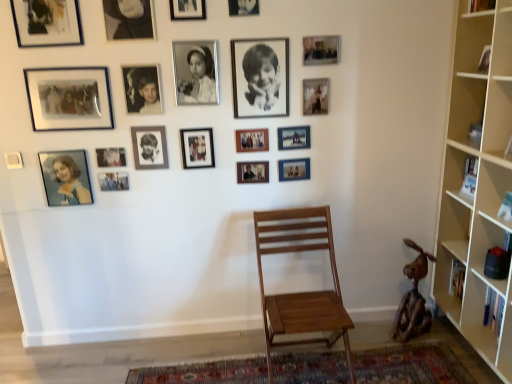
Question: From the image's perspective, is black matte photo frame at center, the fifth picture frame from the right, located beneath wooden chair at center?

Choices:
 (A) yes
 (B) no

Answer: (B)

Question: Does black matte photo frame at center, placed as the fifteenth picture frame when sorted from left to right, have a smaller size compared to wooden chair at center?

Choices:
 (A) no
 (B) yes

Answer: (B)

Question: Is black matte photo frame at center, placed as the fifteenth picture frame when sorted from left to right, far away from wooden chair at center?

Choices:
 (A) no
 (B) yes

Answer: (A)

Question: Can we say black matte photo frame at center, the fifth picture frame from the right, lies outside wooden chair at center?

Choices:
 (A) no
 (B) yes

Answer: (B)

Question: Is black matte photo frame at center, placed as the fifteenth picture frame when sorted from left to right, to the right of wooden chair at center from the viewer's perspective?

Choices:
 (A) no
 (B) yes

Answer: (A)

Question: Is matte plastic photo frame at lower left, which appears as the 18th picture frame when viewed from the right, wider or thinner than metallic silver photo frame at upper center, which is the ninth picture frame from left to right?

Choices:
 (A) wide
 (B) thin

Answer: (B)

Question: Is matte plastic photo frame at lower left, which is counted as the second picture frame, starting from the left, inside or outside of metallic silver photo frame at upper center, the 11th picture frame positioned from the right?

Choices:
 (A) outside
 (B) inside

Answer: (A)

Question: From a real-world perspective, is matte plastic photo frame at lower left, which appears as the 18th picture frame when viewed from the right, above or below metallic silver photo frame at upper center, the 11th picture frame positioned from the right?

Choices:
 (A) below
 (B) above

Answer: (A)

Question: From the image's perspective, is matte plastic photo frame at lower left, which appears as the 18th picture frame when viewed from the right, positioned above or below metallic silver photo frame at upper center, which is the ninth picture frame from left to right?

Choices:
 (A) above
 (B) below

Answer: (B)

Question: From a real-world perspective, is light wood bookcase at right above or below metallic silver photo frame at upper right, the 18th picture frame positioned from the left?

Choices:
 (A) above
 (B) below

Answer: (B)

Question: Do you think light wood bookcase at right is within metallic silver photo frame at upper right, the 18th picture frame positioned from the left, or outside of it?

Choices:
 (A) outside
 (B) inside

Answer: (A)

Question: From their relative heights in the image, would you say light wood bookcase at right is taller or shorter than metallic silver photo frame at upper right, the 18th picture frame positioned from the left?

Choices:
 (A) tall
 (B) short

Answer: (A)

Question: Is point (461, 81) positioned closer to the camera than point (307, 97)?

Choices:
 (A) farther
 (B) closer

Answer: (B)

Question: Looking at the image, does wooden photo frame at center, marked as the fourteenth picture frame in a left-to-right arrangement, seem bigger or smaller compared to rustic wood sculpture at lower right?

Choices:
 (A) big
 (B) small

Answer: (B)

Question: Visually, is wooden photo frame at center, which is the sixth picture frame from right to left, positioned to the left or to the right of rustic wood sculpture at lower right?

Choices:
 (A) right
 (B) left

Answer: (B)